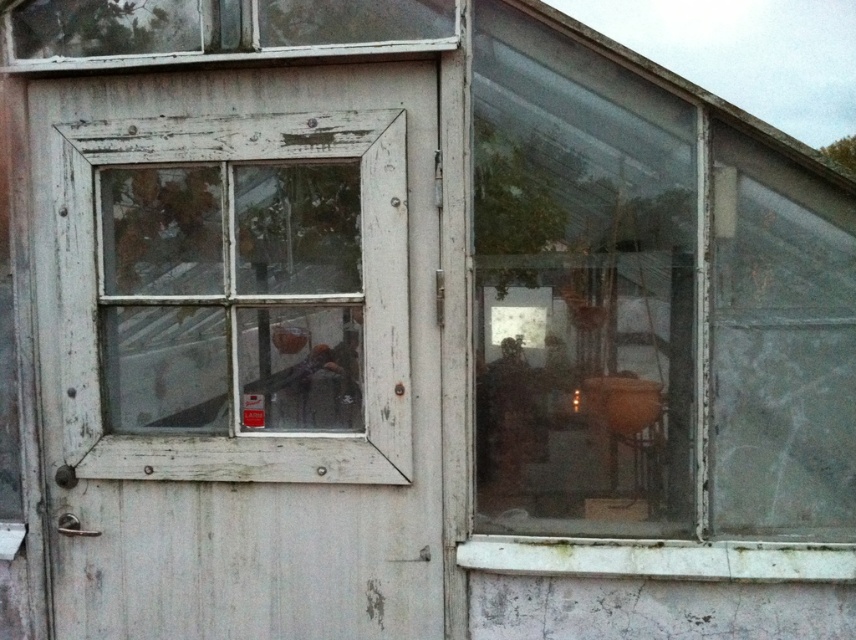
Does white wood screen door at left lie in front of transparent glass window at upper right?

No.

This screenshot has width=856, height=640. I want to click on white wood screen door at left, so click(242, 352).

Who is more forward, (227, 86) or (610, 390)?

Point (610, 390) is in front.

Identify the location of white wood screen door at left. (242, 352).